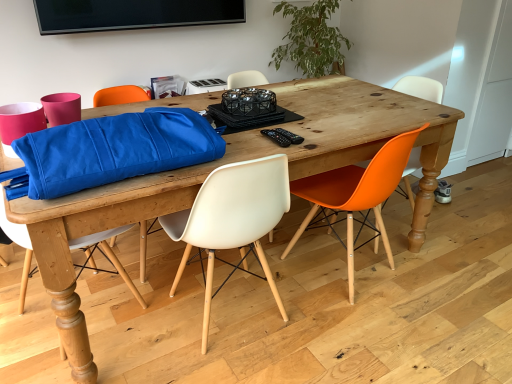
This screenshot has height=384, width=512. What are the coordinates of `vacant region to the right of black plastic remote control at center, acting as the second remote control starting from the left` in the screenshot? It's located at (320, 135).